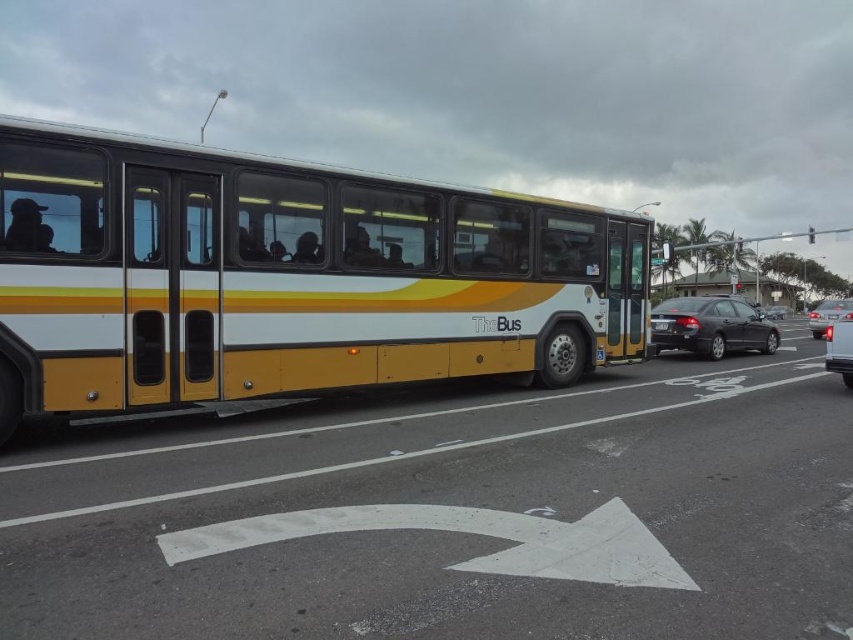
Question: Which of these objects is positioned closest to the satin black sedan at center?

Choices:
 (A) yellow matte bus at center
 (B) glossy silver sedan at right
 (C) black plastic license plate at center
 (D) shiny silver sedan at right

Answer: (C)

Question: Which point is closer to the camera taking this photo?

Choices:
 (A) (846, 349)
 (B) (846, 310)

Answer: (A)

Question: Is satin black sedan at center bigger than black plastic license plate at center?

Choices:
 (A) no
 (B) yes

Answer: (B)

Question: In this image, where is yellow matte bus at center located relative to shiny silver sedan at right?

Choices:
 (A) above
 (B) below

Answer: (B)

Question: Is satin black sedan at center to the right of glossy silver sedan at right from the viewer's perspective?

Choices:
 (A) no
 (B) yes

Answer: (A)

Question: Among these objects, which one is farthest from the camera?

Choices:
 (A) black plastic license plate at center
 (B) satin black sedan at center
 (C) yellow matte bus at center

Answer: (A)